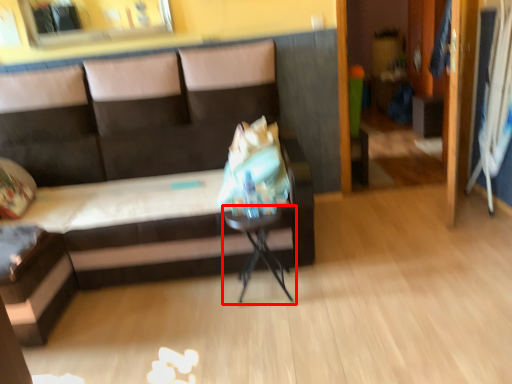
Question: From the image's perspective, what is the correct spatial positioning of table (annotated by the red box) in reference to studio couch?

Choices:
 (A) above
 (B) below

Answer: (B)